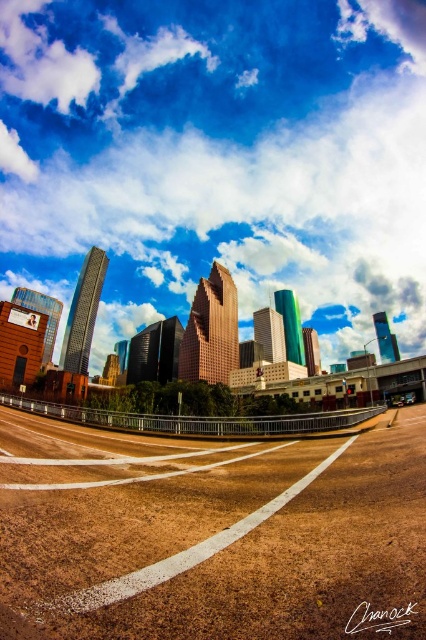
You are driving along the brown gravel highway at lower center and notice a white fluffy cloud in the sky. From your perspective in the vehicle, on which side of the highway would you see the white fluffy cloud at upper center?

The white fluffy cloud at upper center is located to the right side of the brown gravel highway at lower center, so from your driving perspective, you would see it on the right side of the highway.

You are a photographer planning to capture a wide shot of the urban scene. You want to ensure that the white fluffy cloud at upper center and the brown gravel highway at lower center are both visible. Considering their sizes, which object will occupy more space in your photo?

The white fluffy cloud at upper center will occupy more space in the photo because its width surpasses that of the brown gravel highway at lower center.